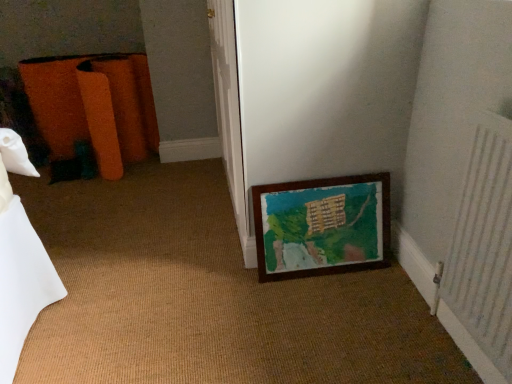
Find the location of `vacant space in white textured radiator at right (from a real-world perspective)`. vacant space in white textured radiator at right (from a real-world perspective) is located at coordinates (450, 350).